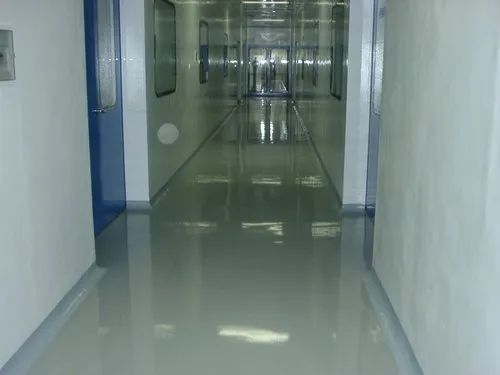
Identify the location of baseboards. coord(39,344), coord(134,210), coord(177,173), coord(329,186), coord(356,212), coord(378,303).